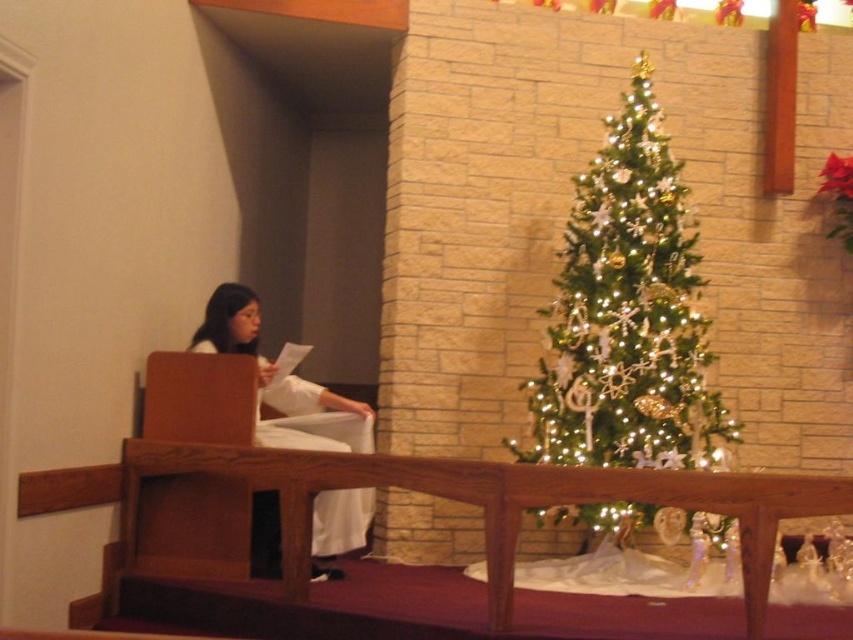
Question: Does iridescent green tree at center appear on the left side of white cloth at left?

Choices:
 (A) yes
 (B) no

Answer: (B)

Question: Can you confirm if iridescent green tree at center is positioned above white cloth at left?

Choices:
 (A) yes
 (B) no

Answer: (A)

Question: Can you confirm if iridescent green tree at center is positioned above white cloth at left?

Choices:
 (A) no
 (B) yes

Answer: (B)

Question: Which point is closer to the camera?

Choices:
 (A) (331, 403)
 (B) (561, 460)

Answer: (B)

Question: Which object is farther from the camera taking this photo?

Choices:
 (A) iridescent green tree at center
 (B) white cloth at left

Answer: (A)

Question: Which point is farther from the camera taking this photo?

Choices:
 (A) (634, 280)
 (B) (312, 547)

Answer: (A)